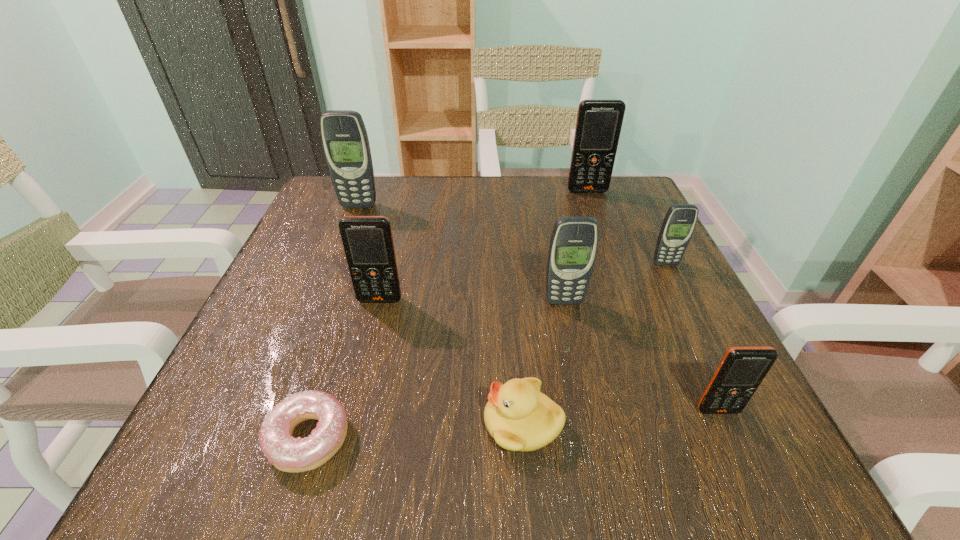
Identify the location of vacant space located on the screen of the smallest orange cellular telephone. (742, 463).

Where is `vacant space located on the screen of the smallest gray cellular telephone`? vacant space located on the screen of the smallest gray cellular telephone is located at coordinates [686, 305].

You are a GUI agent. You are given a task and a screenshot of the screen. Output one action in this format:
    pyautogui.click(x=<x>, y=<y>)
    Task: Click on the vacant space situated 0.330m at the face of the duckling
    The height and width of the screenshot is (540, 960).
    Given the screenshot: What is the action you would take?
    pyautogui.click(x=249, y=423)

Find the location of `free space located 0.380m at the face of the duckling`. free space located 0.380m at the face of the duckling is located at coordinates (212, 423).

The height and width of the screenshot is (540, 960). I want to click on free space located at the face of the duckling, so click(313, 423).

At what (x,y) coordinates should I click in order to perform the action: click on free space located 0.080m on the left of the doughnut. Please return your answer as a coordinate pair (x, y). The image size is (960, 540). Looking at the image, I should click on (209, 437).

You are a GUI agent. You are given a task and a screenshot of the screen. Output one action in this format:
    pyautogui.click(x=<x>, y=<y>)
    Task: Click on the duckling that is at the near edge
    
    Given the screenshot: What is the action you would take?
    pyautogui.click(x=519, y=417)

In order to click on doughnut at the near edge in this screenshot , I will do `click(288, 454)`.

I want to click on cellular telephone present at the left edge, so click(x=344, y=137).

Find the location of a particular element. The image size is (960, 540). doughnut that is at the left edge is located at coordinates (288, 454).